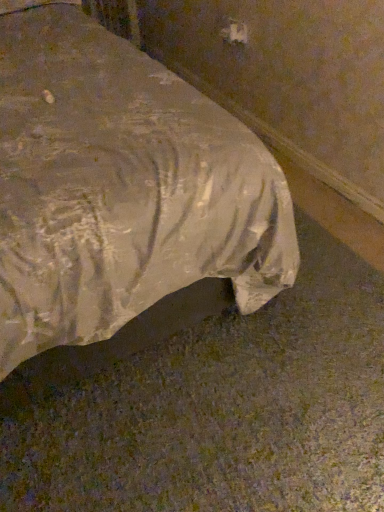
Image resolution: width=384 pixels, height=512 pixels. Describe the element at coordinates (121, 188) in the screenshot. I see `silvery fabric bed at lower left` at that location.

Locate an element on the screen. silvery fabric bed at lower left is located at coordinates (121, 188).

I want to click on silvery fabric bed at lower left, so click(x=121, y=188).